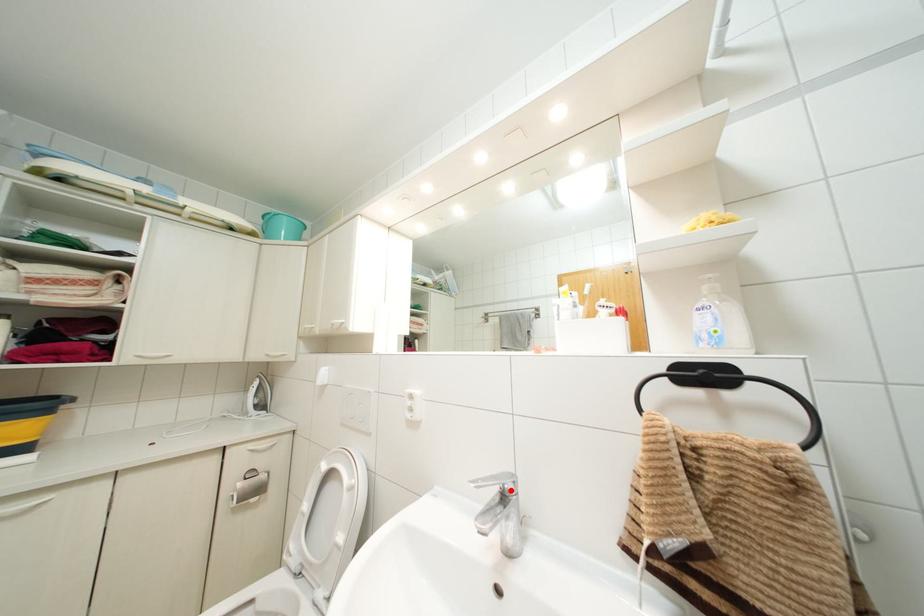
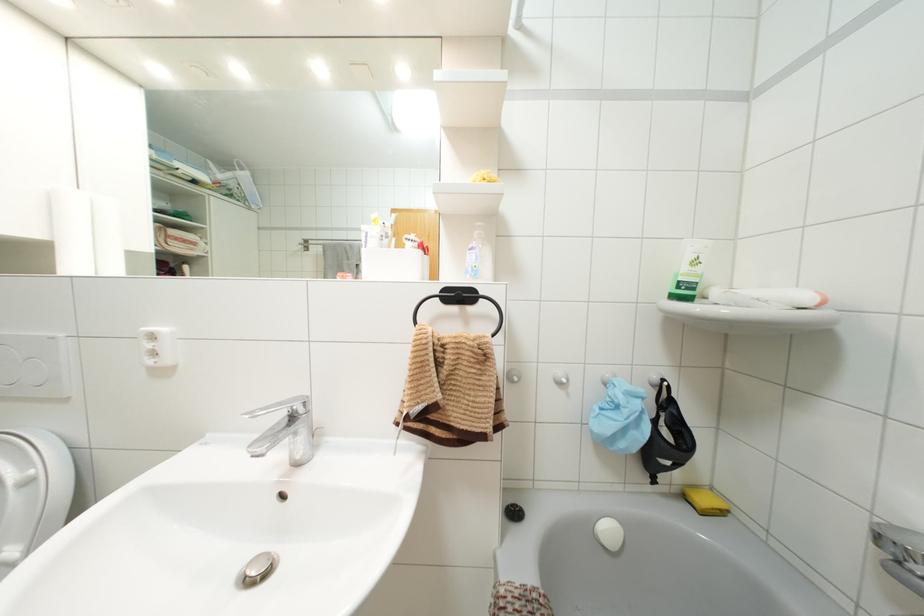
Find the pixel in the second image that matches the highlighted location in the first image.

(300, 410)